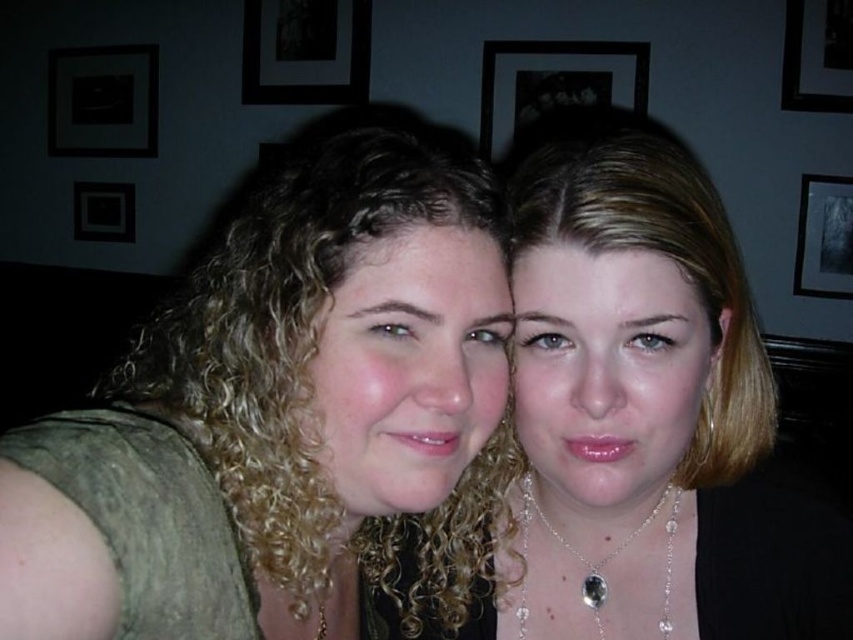
You are a photographer standing between the two people in the image. You want to take a photo of the dark matte picture frame at upper left without moving either person. Can you fit both people and the frame in the camera viewfinder?

The two people are 3.26 meters apart from each other. Since the photographer is positioned between them, the distance to the frame at upper left would depend on the camera lens. However, the question doesn not provide information about the camera lens or the size of the viewfinder. Therefore, it is impossible to determine if both the people and the frame can fit in the viewfinder without additional details about the camera equipment.